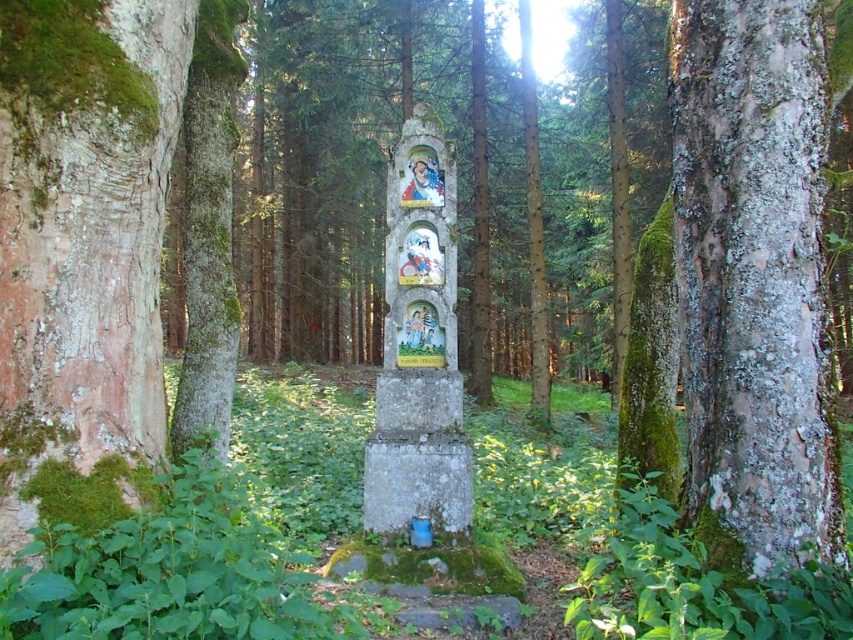
Does smooth reddish-brown rock at left have a lesser height compared to speckled bark tree trunk at right?

Yes, smooth reddish-brown rock at left is shorter than speckled bark tree trunk at right.

Consider the image. Is smooth reddish-brown rock at left taller than speckled bark tree trunk at right?

Incorrect, smooth reddish-brown rock at left's height is not larger of speckled bark tree trunk at right's.

Locate an element on the screen. Image resolution: width=853 pixels, height=640 pixels. smooth reddish-brown rock at left is located at coordinates (83, 252).

Which is more to the right, smooth reddish-brown rock at left or stone statue at center?

From the viewer's perspective, stone statue at center appears more on the right side.

Who is lower down, smooth reddish-brown rock at left or stone statue at center?

stone statue at center is lower down.

Looking at this image, who is more forward, (102, 227) or (431, 228)?

Point (102, 227) is more forward.

Image resolution: width=853 pixels, height=640 pixels. I want to click on smooth reddish-brown rock at left, so click(83, 252).

Does speckled bark tree trunk at right have a greater width compared to stone statue at center?

No.

Is point (740, 326) more distant than point (390, 204)?

No, (740, 326) is in front of (390, 204).

Where is `speckled bark tree trunk at right`? speckled bark tree trunk at right is located at coordinates (753, 282).

Find the location of `speckled bark tree trunk at right`. speckled bark tree trunk at right is located at coordinates (753, 282).